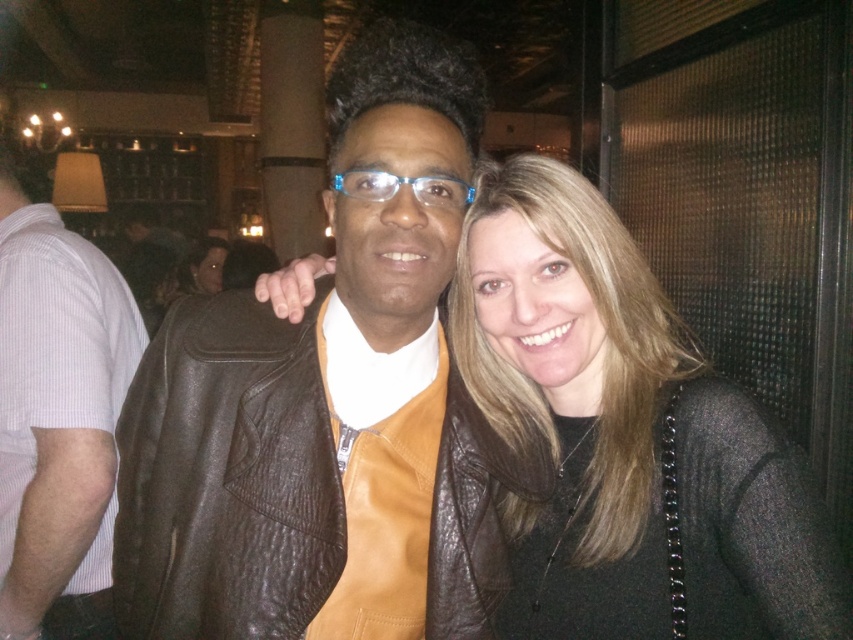
Which is in front, point (192, 312) or point (38, 321)?

Positioned in front is point (192, 312).

Where is `brown leather jacket at center`? The width and height of the screenshot is (853, 640). brown leather jacket at center is located at coordinates (291, 369).

From the picture: Can you confirm if brown leather jacket at center is positioned to the right of matte black sweater at center?

Incorrect, brown leather jacket at center is not on the right side of matte black sweater at center.

Find the location of a particular element. This screenshot has height=640, width=853. brown leather jacket at center is located at coordinates (291, 369).

Can you confirm if matte black sweater at center is bigger than leather jacket at center?

No, matte black sweater at center is not bigger than leather jacket at center.

The width and height of the screenshot is (853, 640). I want to click on matte black sweater at center, so click(x=625, y=436).

The image size is (853, 640). Identify the location of matte black sweater at center. (625, 436).